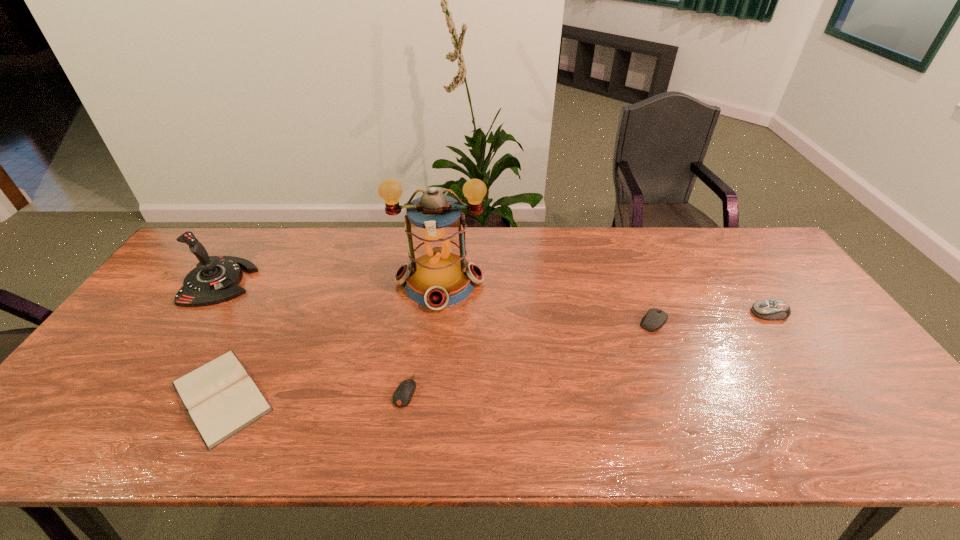
This screenshot has width=960, height=540. I want to click on object that is at the far left corner, so click(x=215, y=279).

Locate an element on the screen. vacant space at the far edge is located at coordinates (312, 266).

I want to click on free region at the near edge of the desktop, so [664, 429].

The width and height of the screenshot is (960, 540). I want to click on free location at the left edge of the desktop, so click(x=169, y=285).

In the image, there is a desktop. Identify the location of vacant area at the right edge. (801, 307).

The height and width of the screenshot is (540, 960). In the image, there is a desktop. Identify the location of blank space at the near left corner. (59, 429).

Where is `vacant region at the far right corner of the desktop`? This screenshot has height=540, width=960. vacant region at the far right corner of the desktop is located at coordinates (771, 265).

The height and width of the screenshot is (540, 960). I want to click on vacant space at the near right corner of the desktop, so click(x=855, y=446).

Identify the location of empty location between the lantern and the joystick. (330, 282).

Where is `vacant area between the shortest object and the nearest computer mouse`? vacant area between the shortest object and the nearest computer mouse is located at coordinates (313, 394).